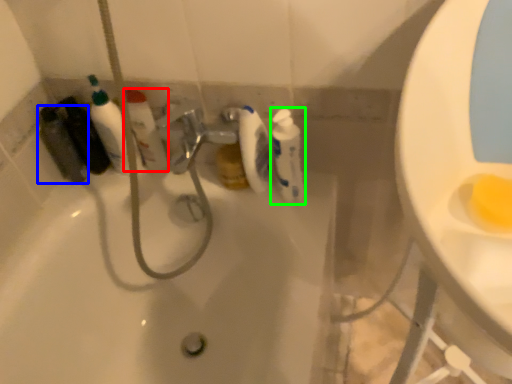
Question: Based on their relative distances, which object is nearer to cleaning product (highlighted by a red box)? Choose from mouthwash (highlighted by a blue box) and cleaning product (highlighted by a green box).

Choices:
 (A) mouthwash
 (B) cleaning product

Answer: (A)